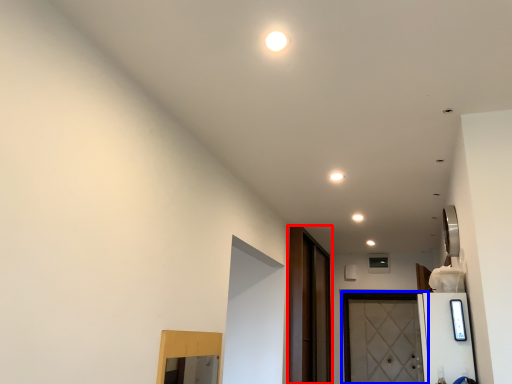
Question: Which object appears farthest to the camera in this image, screen door (highlighted by a red box) or door (highlighted by a blue box)?

Choices:
 (A) screen door
 (B) door

Answer: (B)